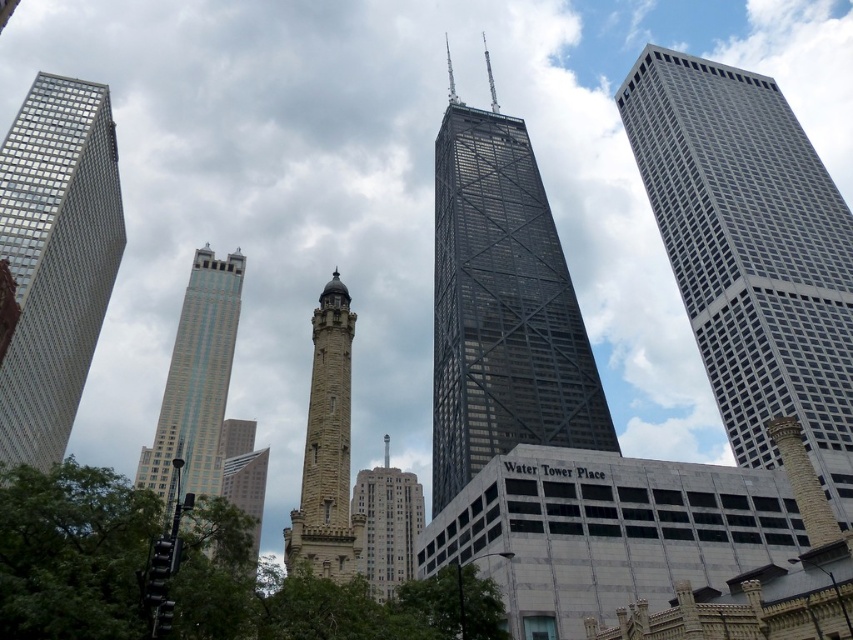
In the scene shown: You are an architect planning to install a new light sculpture between the metallic grid skyscraper at right and the glassy steel skyscraper at lower left. Based on their positions, which skyscraper should the sculpture be closer to in order to maintain symmetry with the John Hancock Center in the center?

The metallic grid skyscraper at right is to the right of the glassy steel skyscraper at lower left. To maintain symmetry with the John Hancock Center in the center, the sculpture should be placed closer to the glassy steel skyscraper at lower left so it balances the distance from the center building.